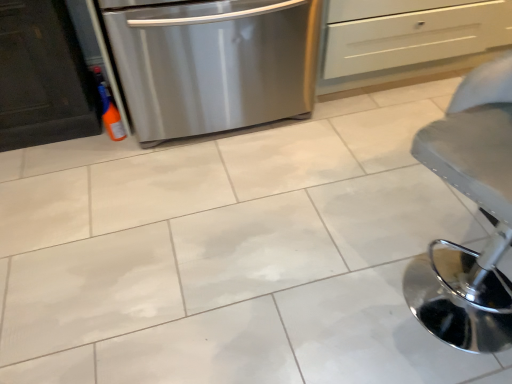
Locate an element on the screen. Image resolution: width=512 pixels, height=384 pixels. vacant area that lies between stainless steel dishwasher at left and white matte drawer at upper center is located at coordinates pyautogui.click(x=375, y=98).